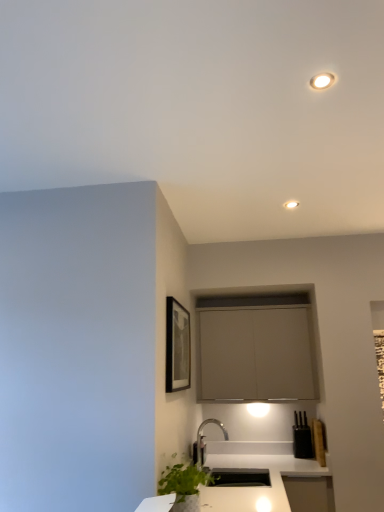
Question: Considering the positions of white glossy countertop at lower center and matte white recessed light at upper center in the image, is white glossy countertop at lower center taller or shorter than matte white recessed light at upper center?

Choices:
 (A) tall
 (B) short

Answer: (A)

Question: From the image's perspective, is white glossy countertop at lower center positioned above or below matte white recessed light at upper center?

Choices:
 (A) above
 (B) below

Answer: (B)

Question: Based on their relative distances, which object is farther from the black matte picture frame at upper center?

Choices:
 (A) green leafy plant at lower left
 (B) matte gray cabinet at center
 (C) black matte knife block at lower right
 (D) white glossy countertop at lower center
 (E) matte white recessed light at upper center

Answer: (E)

Question: Which of these objects is positioned closest to the black matte knife block at lower right?

Choices:
 (A) black matte picture frame at upper center
 (B) matte white recessed light at upper center
 (C) matte gray cabinet at center
 (D) white glossy countertop at lower center
 (E) green leafy plant at lower left

Answer: (D)